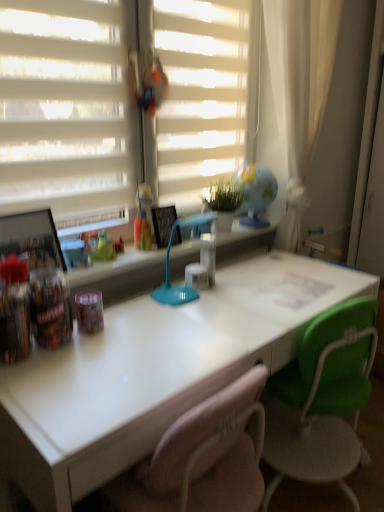
Question: Relative to white matte blinds at upper center, is white matte shutter at upper left in front or behind?

Choices:
 (A) behind
 (B) front

Answer: (B)

Question: Based on their positions, is white matte shutter at upper left located to the left or right of white matte blinds at upper center?

Choices:
 (A) right
 (B) left

Answer: (B)

Question: Which object is the closest to the translucent plastic cup at upper center?

Choices:
 (A) white matte shutter at upper left
 (B) white matte blinds at upper center
 (C) blue plastic table lamp at center
 (D) white glossy desk at center
 (E) green fabric chair at center

Answer: (C)

Question: Which object is the farthest from the blue plastic table lamp at center?

Choices:
 (A) white glossy desk at center
 (B) green fabric chair at center
 (C) translucent plastic cup at upper center
 (D) white matte blinds at upper center
 (E) white matte shutter at upper left

Answer: (B)